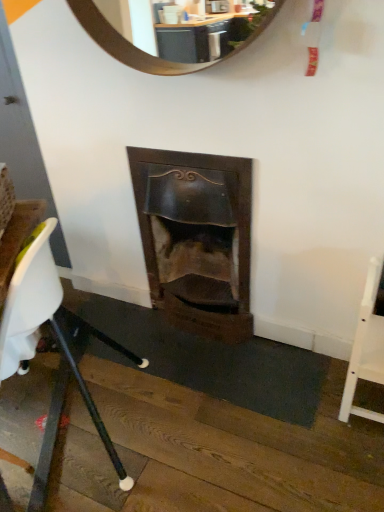
The image size is (384, 512). In order to click on vacant space underneath white wood chair at right, the first chair viewed from the right (from a real-world perspective) in this screenshot , I will do `click(357, 393)`.